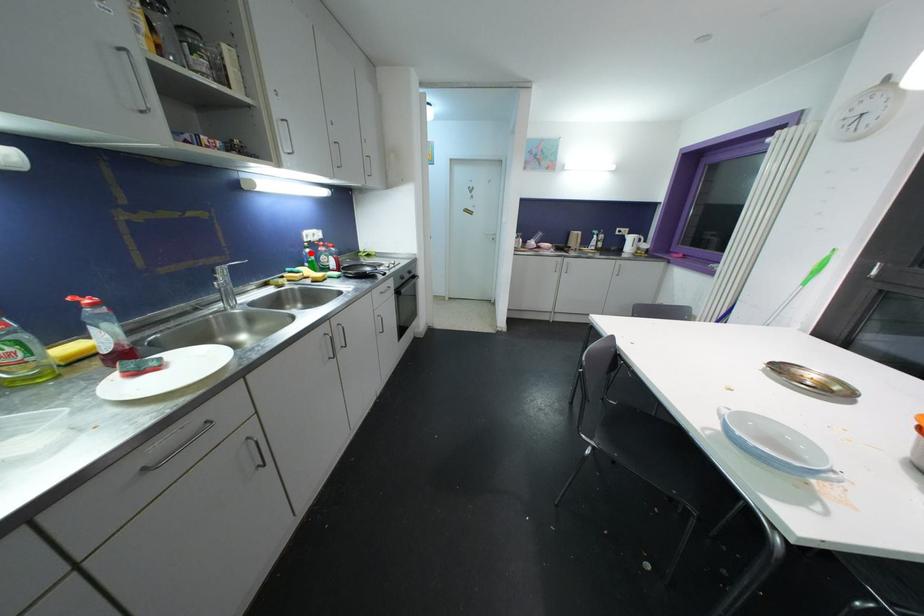
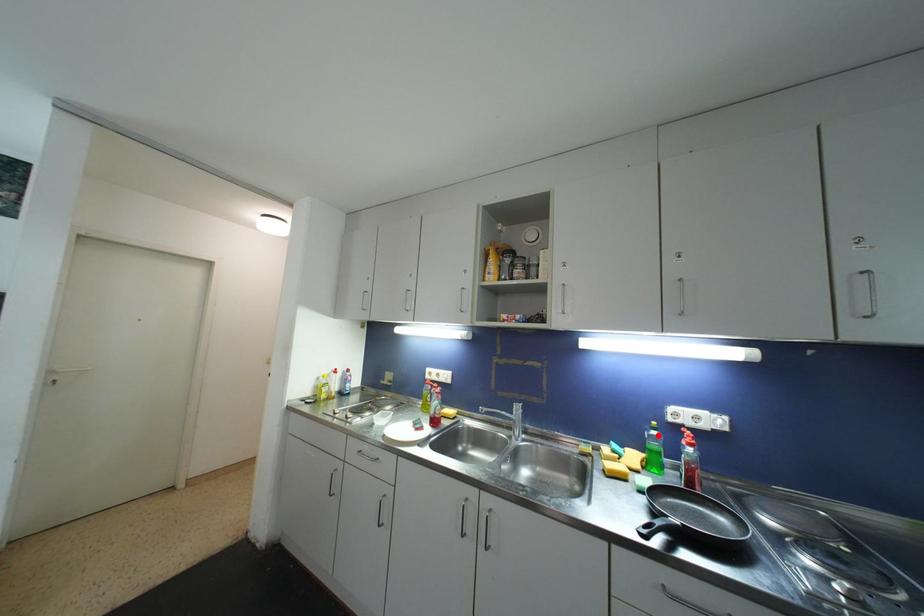
I am providing you with two images of the same scene from different viewpoints. A red point is marked on the first image and another point is marked on the second image. Are the points marked in image1 and image2 representing the same 3D position?

Yes